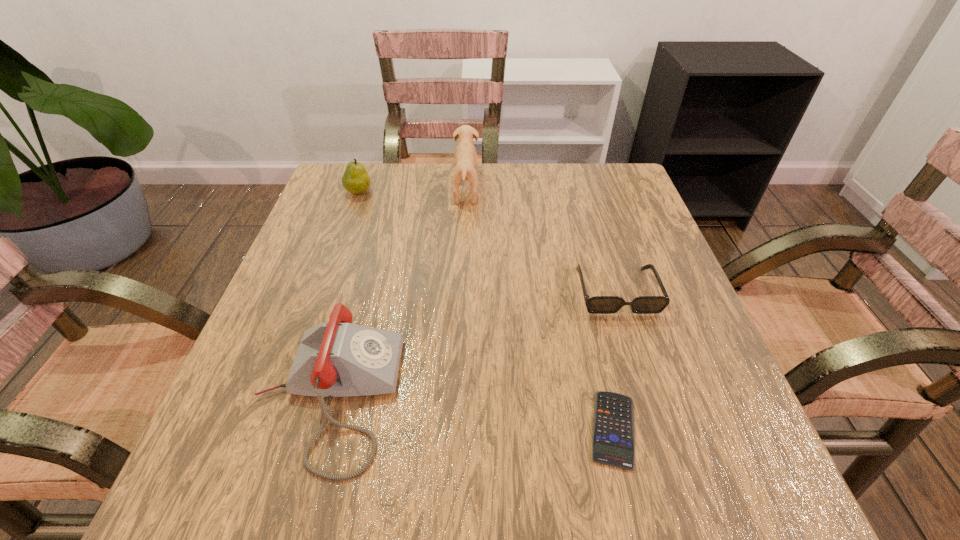
Where is `object located in the far left corner section of the desktop`? object located in the far left corner section of the desktop is located at coordinates (355, 180).

You are a GUI agent. You are given a task and a screenshot of the screen. Output one action in this format:
    pyautogui.click(x=<x>, y=<y>)
    Task: Click on the object that is positioned at the near left corner
    This screenshot has height=540, width=960.
    Given the screenshot: What is the action you would take?
    pyautogui.click(x=336, y=359)

Where is `object that is at the near right corner`? object that is at the near right corner is located at coordinates (613, 437).

This screenshot has width=960, height=540. What are the coordinates of `free region at the far edge of the desktop` in the screenshot? It's located at (436, 180).

Identify the location of vacant space at the left edge. The height and width of the screenshot is (540, 960). (319, 258).

The image size is (960, 540). Identify the location of vacant space at the right edge. (672, 330).

In the image, there is a desktop. Identify the location of free space at the far left corner. This screenshot has height=540, width=960. (373, 206).

In the image, there is a desktop. Identify the location of vacant space at the far right corner. Image resolution: width=960 pixels, height=540 pixels. (570, 168).

The width and height of the screenshot is (960, 540). In order to click on empty space that is in between the tallest object and the pear in this screenshot , I will do `click(413, 191)`.

At what (x,y) coordinates should I click in order to perform the action: click on free spot between the telephone and the third object from left to right. Please return your answer as a coordinate pair (x, y). This screenshot has height=540, width=960. Looking at the image, I should click on (396, 293).